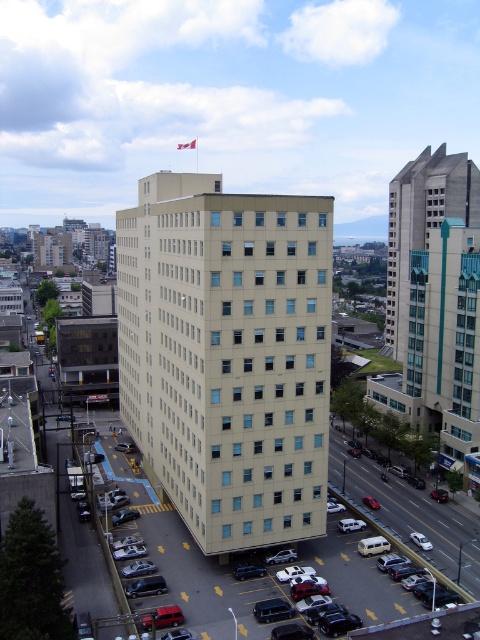
Is black asphalt parking lot at lower center to the right of red fabric flag at upper center from the viewer's perspective?

Correct, you'll find black asphalt parking lot at lower center to the right of red fabric flag at upper center.

Is black asphalt parking lot at lower center taller than red fabric flag at upper center?

No.

Is point (336, 458) positioned behind point (180, 148)?

No, (336, 458) is closer to viewer.

Find the location of a particular element. The height and width of the screenshot is (640, 480). black asphalt parking lot at lower center is located at coordinates (411, 513).